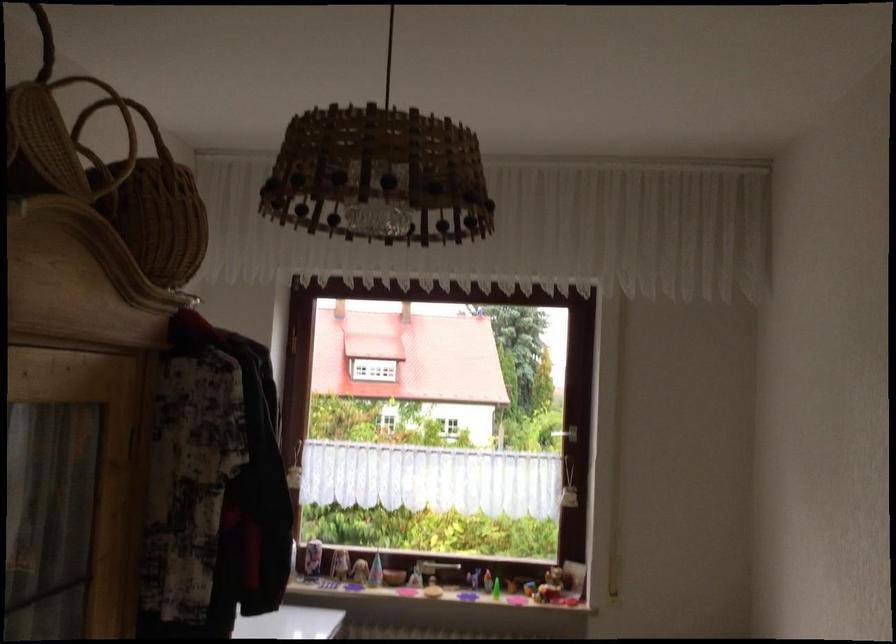
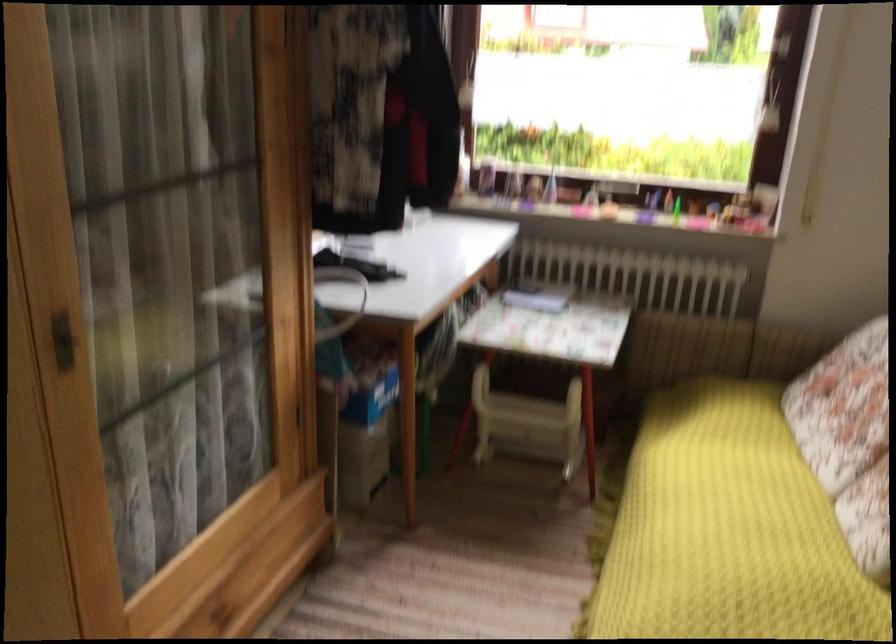
Question: How did the camera likely rotate?

Choices:
 (A) Left
 (B) Right
 (C) Up
 (D) Down

Answer: (D)